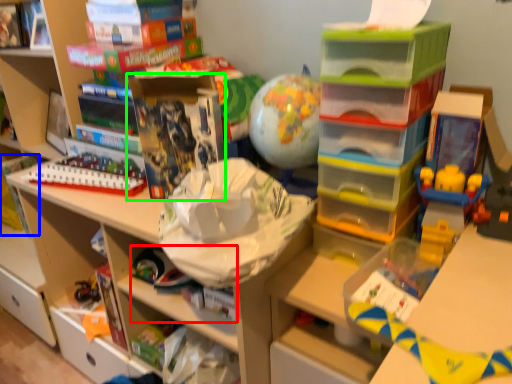
Question: Estimate the real-world distances between objects in this image. Which object is closer to book (highlighted by a red box), book (highlighted by a blue box) or book (highlighted by a green box)?

Choices:
 (A) book
 (B) book

Answer: (B)